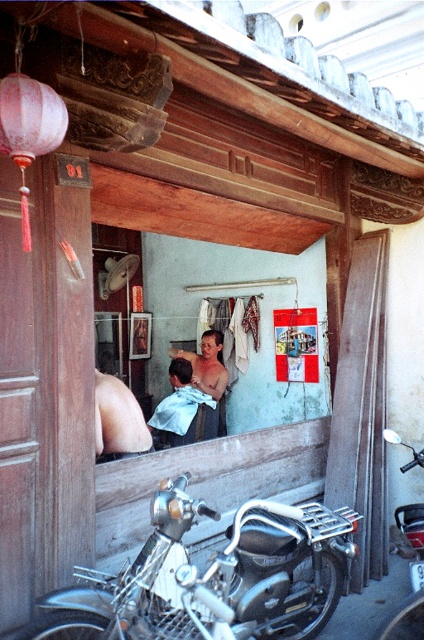
Question: Which point is farther to the camera?

Choices:
 (A) (387, 440)
 (B) (105, 605)

Answer: (A)

Question: Observing the image, what is the correct spatial positioning of shiny chrome motorcycle at lower left in reference to shiny metallic hairdryer at center?

Choices:
 (A) left
 (B) right

Answer: (B)

Question: Estimate the real-world distances between objects in this image. Which object is closer to the shiny chrome motorcycle at lower left?

Choices:
 (A) shiny chrome motorcycle at lower right
 (B) light blue fabric at center

Answer: (A)

Question: Does shiny chrome motorcycle at lower left appear under light blue fabric at center?

Choices:
 (A) no
 (B) yes

Answer: (B)

Question: Which point is farther to the camera?

Choices:
 (A) (189, 378)
 (B) (136, 557)
 (C) (421, 636)

Answer: (A)

Question: Is shiny chrome motorcycle at lower left thinner than shiny metallic hairdryer at center?

Choices:
 (A) no
 (B) yes

Answer: (A)